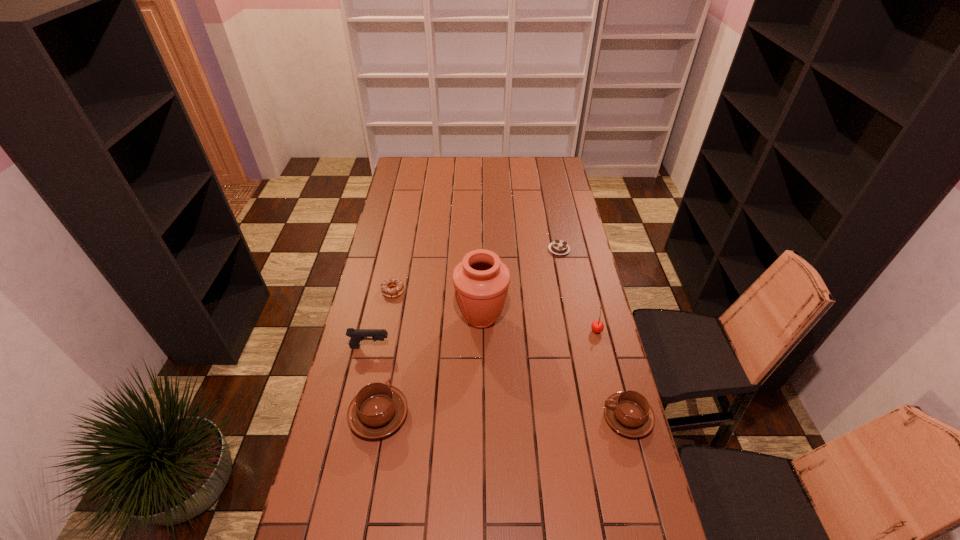
I want to click on vacant area situated 0.130m on the side of the left cappuccino with the handle, so click(x=390, y=356).

At what (x,y) coordinates should I click in order to perform the action: click on vacant position located on the side of the left cappuccino with the handle. Please return your answer as a coordinate pair (x, y). The width and height of the screenshot is (960, 540). Looking at the image, I should click on (399, 300).

In order to click on free space located on the side of the left cappuccino with the handle in this screenshot , I will do `click(396, 316)`.

At what (x,y) coordinates should I click in order to perform the action: click on blank space located on the side of the right cappuccino with the handle. Please return your answer as a coordinate pair (x, y). Looking at the image, I should click on (512, 417).

The image size is (960, 540). What are the coordinates of `free spot located 0.100m on the side of the right cappuccino with the handle` in the screenshot? It's located at (570, 417).

Where is `free space located 0.060m on the side of the right cappuccino with the handle`? free space located 0.060m on the side of the right cappuccino with the handle is located at coordinates (584, 417).

In order to click on free space located on the left of the chocolate cake in this screenshot , I will do `click(458, 249)`.

This screenshot has height=540, width=960. Find the location of `free space located on the left of the cherry`. free space located on the left of the cherry is located at coordinates (482, 330).

Where is `free spot located 0.290m on the right of the tallest object`? The image size is (960, 540). free spot located 0.290m on the right of the tallest object is located at coordinates (586, 318).

Where is `free point located 0.080m at the barrel of the pistol`? The width and height of the screenshot is (960, 540). free point located 0.080m at the barrel of the pistol is located at coordinates (413, 347).